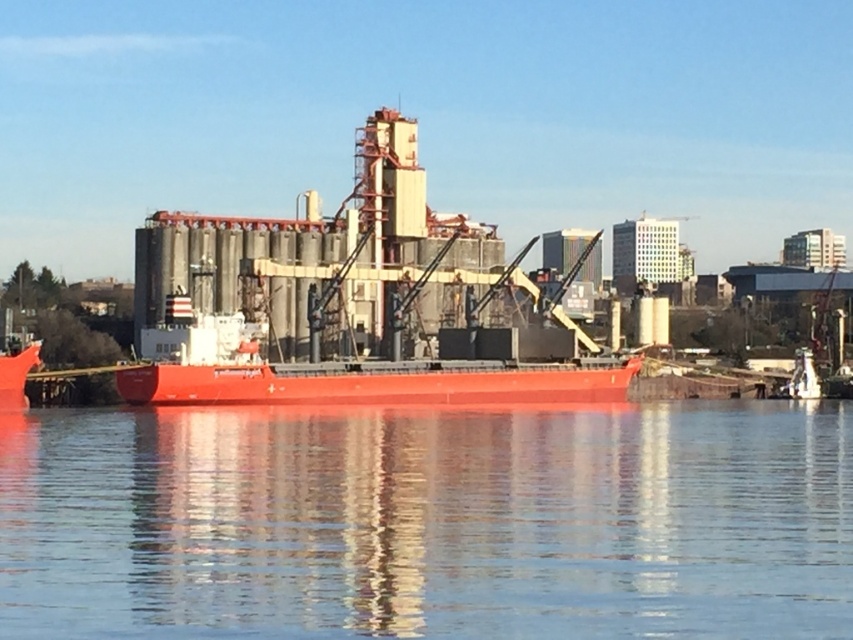
You are a crane operator at the port and need to lower a heavy container onto the smooth red ship at center from the smooth water at lower center. Can you safely lower the container if the crane has a maximum reach of 120 feet?

The smooth water at lower center and smooth red ship at center are 124.64 feet apart. Since the crane can only reach 120 feet, it cannot safely lower the container the full distance required.

You are standing on the deck of the red industrial ship and looking towards the industrial facility in the background. There is a point marked at coordinates [428,522]. What object is located at this point?

The point at coordinates [428,522] is occupied by smooth water at lower center.